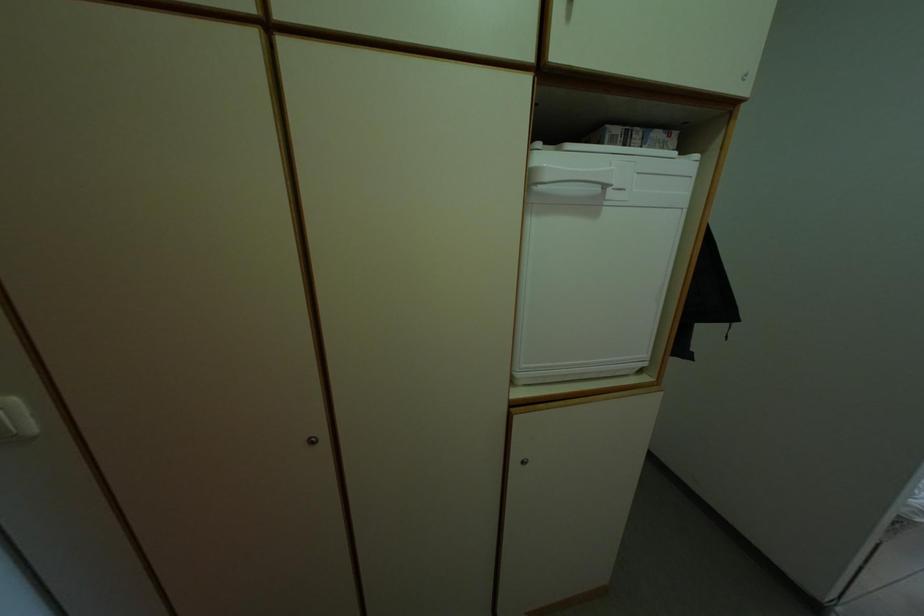
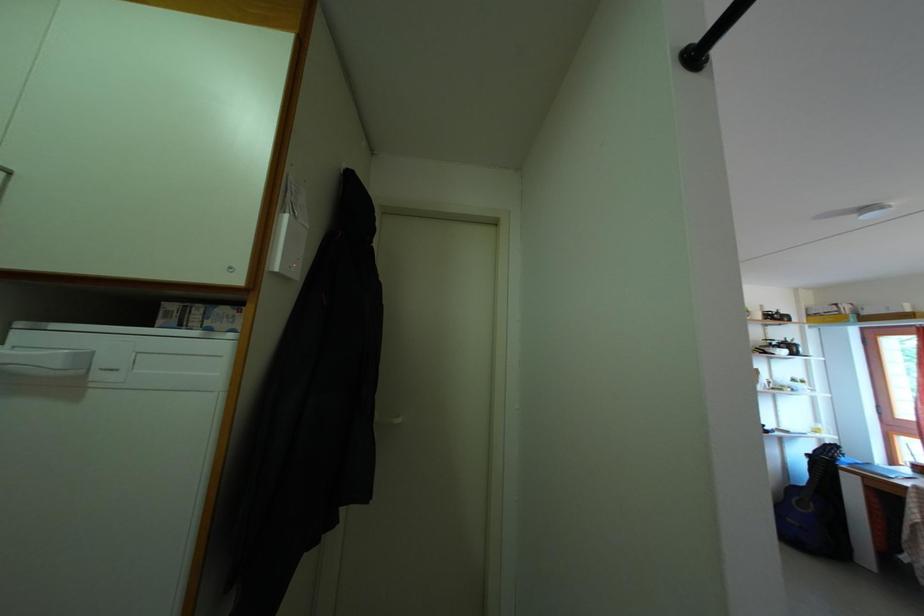
Question: The images are taken continuously from a first-person perspective. In which direction are you moving?

Choices:
 (A) Left
 (B) Right
 (C) Forward
 (D) Backward

Answer: (B)